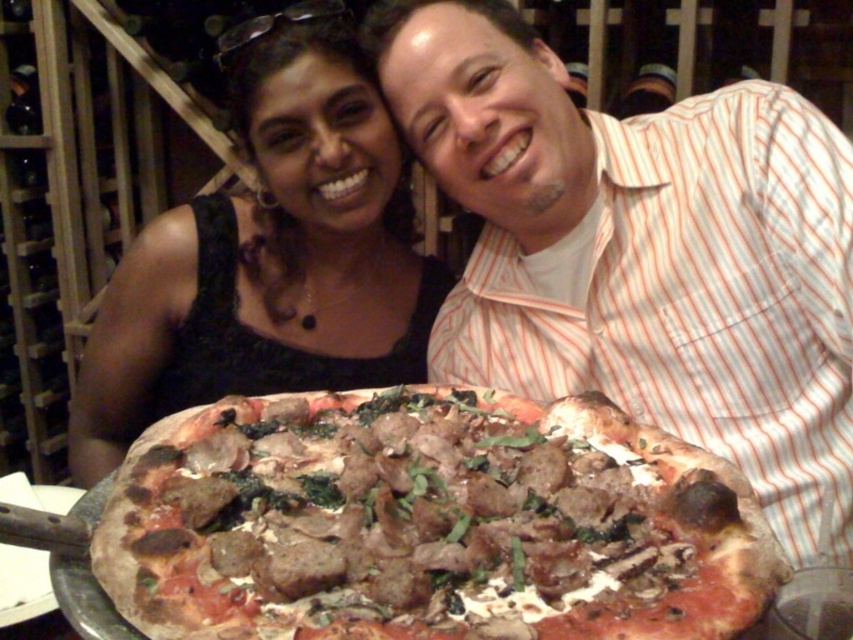
Is striped shirt at center closer to the viewer compared to golden-brown crusty pizza at center?

No, it is behind golden-brown crusty pizza at center.

Who is taller, striped shirt at center or golden-brown crusty pizza at center?

Standing taller between the two is striped shirt at center.

Is point (447, 124) in front of point (648, 568)?

That is False.

Where is `striped shirt at center`? striped shirt at center is located at coordinates (641, 252).

Does striped shirt at center appear on the right side of black lace dress at upper left?

Yes, striped shirt at center is to the right of black lace dress at upper left.

In the scene shown: Can you confirm if striped shirt at center is taller than black lace dress at upper left?

Correct, striped shirt at center is much taller as black lace dress at upper left.

Locate an element on the screen. The height and width of the screenshot is (640, 853). striped shirt at center is located at coordinates (641, 252).

Does point (555, 452) come closer to viewer compared to point (370, 291)?

Yes, it is in front of point (370, 291).

The height and width of the screenshot is (640, 853). Identify the location of golden-brown crusty pizza at center. (428, 522).